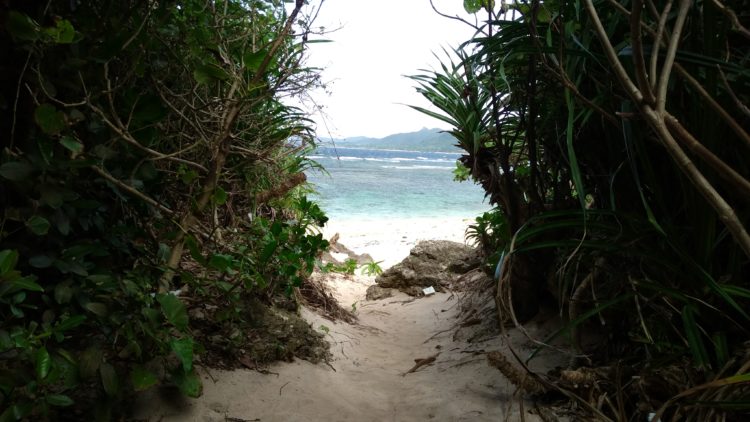
You are a GUI agent. You are given a task and a screenshot of the screen. Output one action in this format:
    pyautogui.click(x=<x>, y=<y>)
    Task: Click on the liquor bottle
    This screenshot has height=422, width=750.
    Given the screenshot: What is the action you would take?
    pyautogui.click(x=426, y=290)